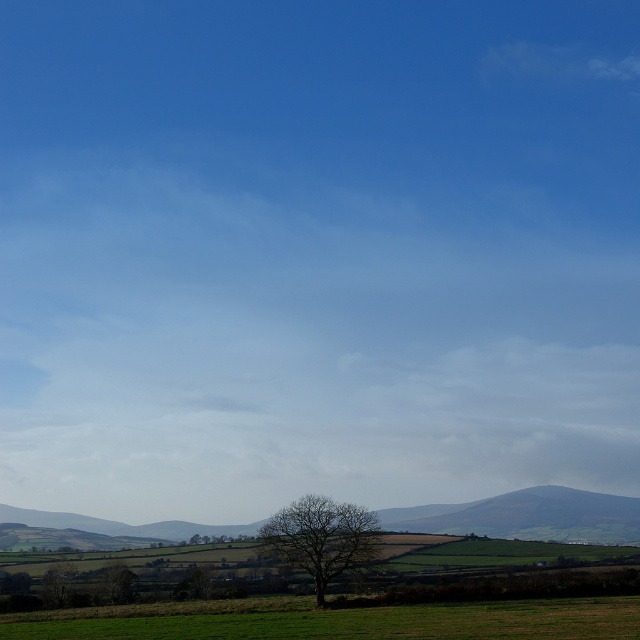
You are standing in the middle of the green grassy field and want to walk towards the green grassy hillside at lower center. Based on the coordinates provided, is the hillside located to your front, back, left, or right?

The green grassy hillside at lower center is located at coordinates point (528, 516). Since the coordinate system places lower center as the reference point, the hillside is positioned directly in front of you.

You are standing at the point labeled point (528, 516) in the image. Looking around, you see the leafless tree in the foreground and the rolling hills in the midground. Which direction should you walk to reach the leafless tree?

The point labeled point (528, 516) is on the green grassy hillside at lower center. The leafless tree is in the foreground, which is closer to the viewer. To reach the leafless tree, you should walk forward or towards the front of the image.

You are a hiker who wants to take a photo of both the bare tree at center and the green leafy tree at lower center in the same frame. Given that your camera has a maximum focus range of 15 meters, will you be able to capture both trees clearly in one shot?

The bare tree at center and green leafy tree at lower center are 16.79 meters apart from each other. Since the distance between them exceeds the camera maximum focus range of 15 meters, you won